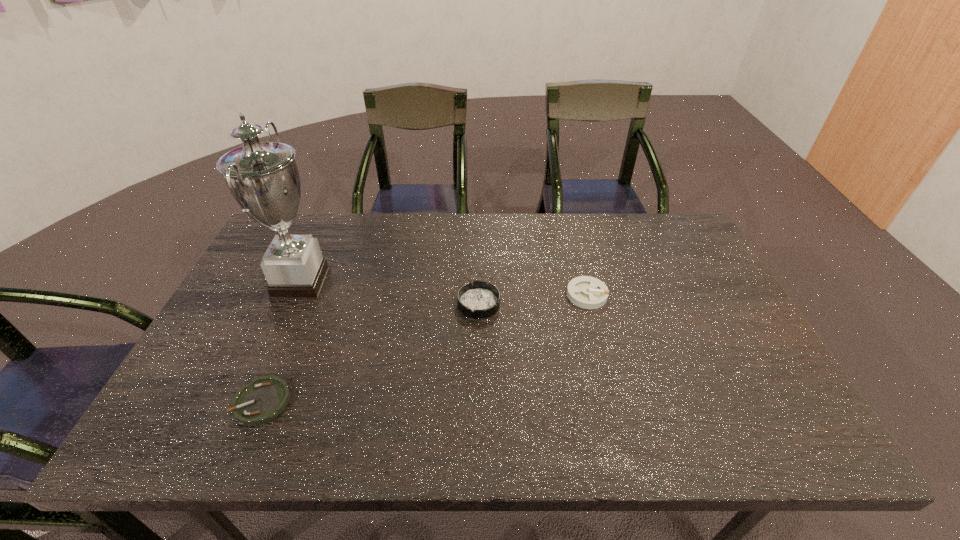
Locate an element on the screen. This screenshot has height=540, width=960. free space between the trophy cup and the rightmost object is located at coordinates (444, 288).

Identify the location of free area in between the second ashtray from left to right and the rightmost ashtray. (533, 299).

This screenshot has width=960, height=540. In order to click on free area in between the shortest object and the rightmost ashtray in this screenshot , I will do click(424, 348).

At what (x,y) coordinates should I click in order to perform the action: click on blank region between the third object from left to right and the rightmost ashtray. Please return your answer as a coordinate pair (x, y). Looking at the image, I should click on (533, 299).

Identify the location of empty space between the leftmost ashtray and the rightmost ashtray. Image resolution: width=960 pixels, height=540 pixels. (424, 348).

Locate an element on the screen. unoccupied position between the third object from left to right and the tallest object is located at coordinates (390, 293).

What are the coordinates of `blank region between the second ashtray from right to left and the rightmost object` in the screenshot? It's located at (533, 299).

Where is `vacant region between the third object from left to right and the tallest object`? This screenshot has width=960, height=540. vacant region between the third object from left to right and the tallest object is located at coordinates (390, 293).

I want to click on vacant region between the rightmost ashtray and the second object from right to left, so click(x=533, y=299).

Identify which object is the closest to the shortest ashtray. Please provide its 2D coordinates. Your answer should be formatted as a tuple, i.e. [(x, y)], where the tuple contains the x and y coordinates of a point satisfying the conditions above.

[(263, 178)]